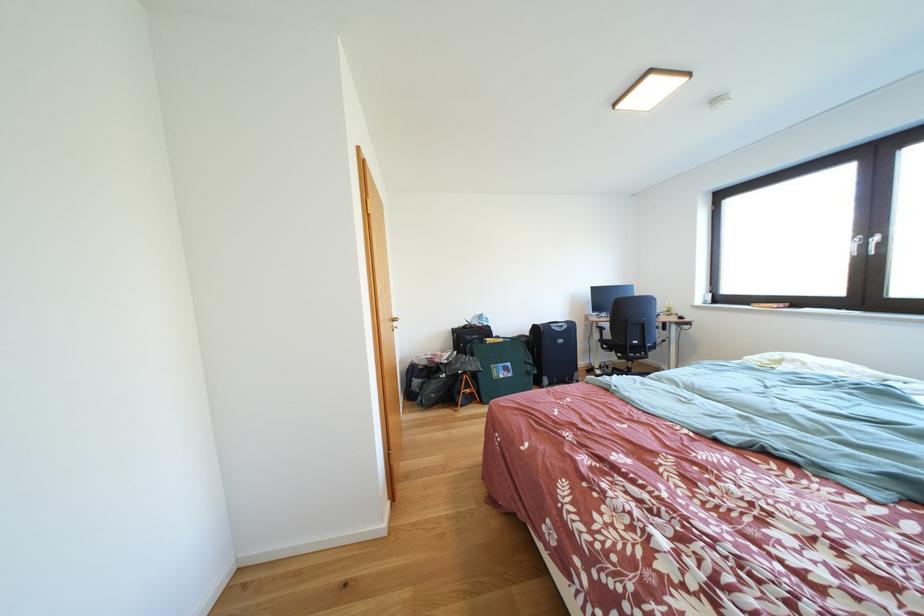
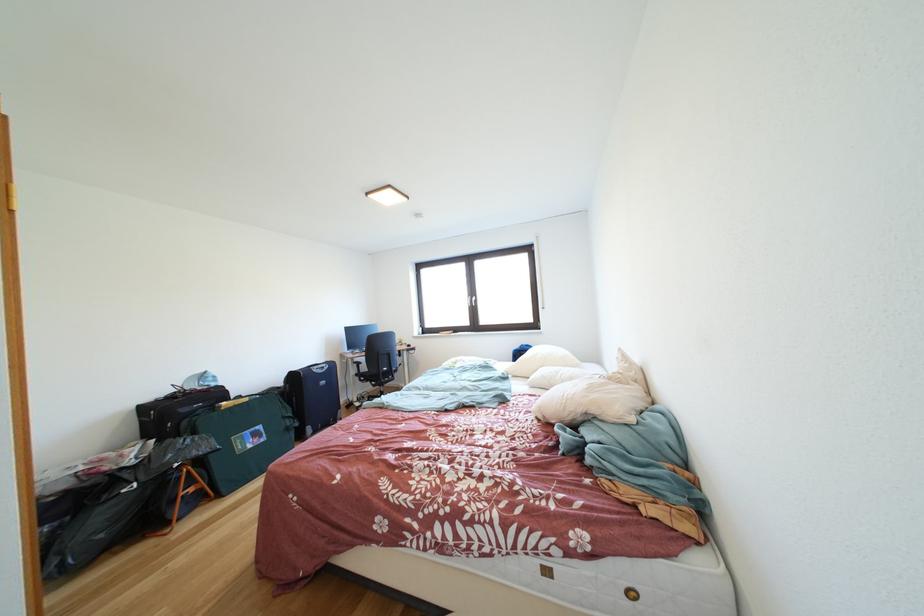
The point at (627, 363) is marked in the first image. Where is the corresponding point in the second image?

(383, 391)